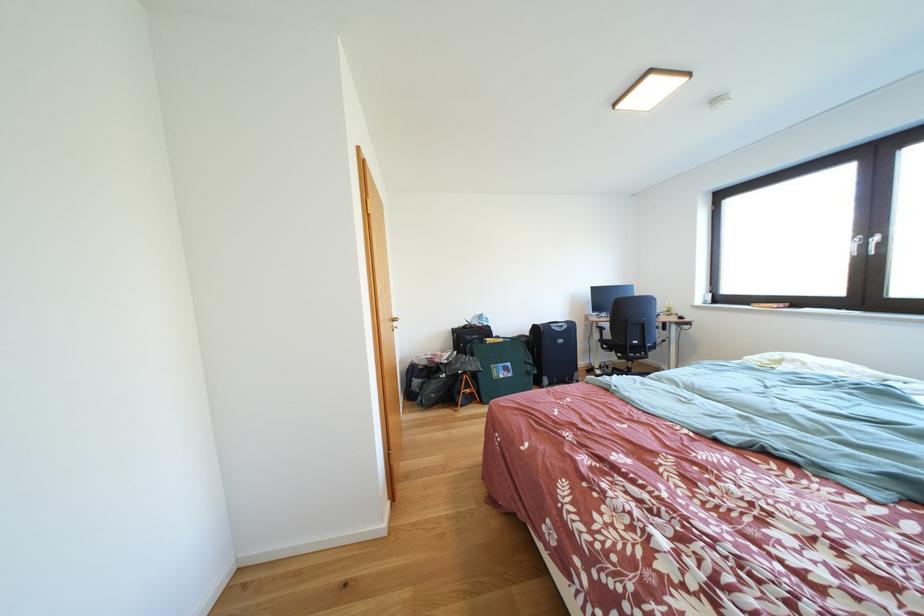
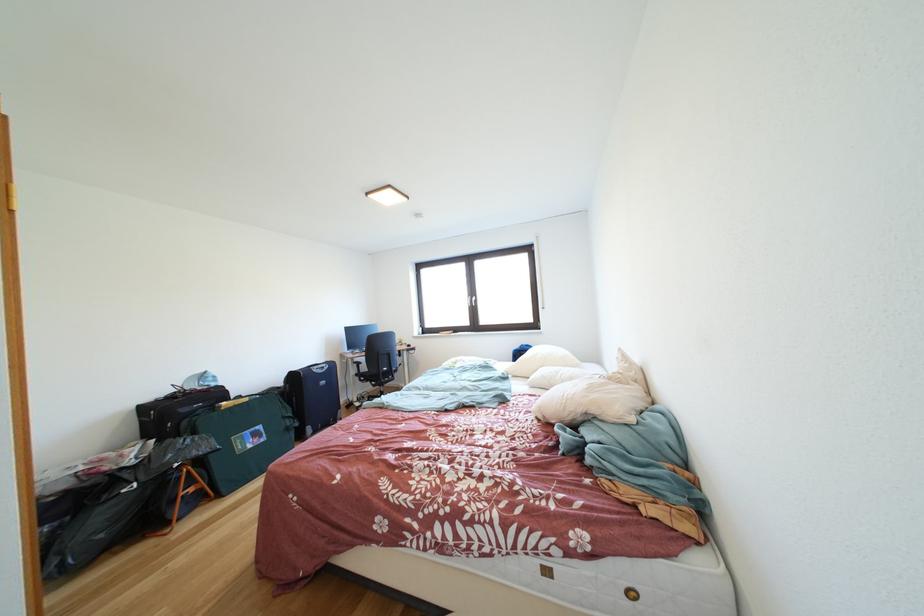
The point at (627, 363) is marked in the first image. Where is the corresponding point in the second image?

(383, 391)